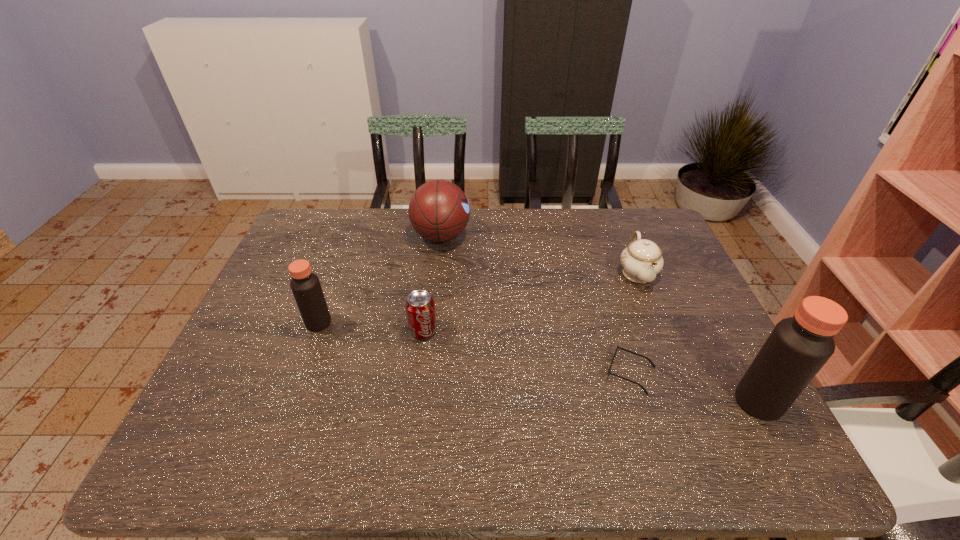
Locate an element on the screen. This screenshot has width=960, height=540. object that is the third nearest to the basketball is located at coordinates (641, 261).

Image resolution: width=960 pixels, height=540 pixels. I want to click on vacant space that satisfies the following two spatial constraints: 1. on the back side of the left vinegar; 2. on the left side of the basketball, so click(350, 236).

Locate an element on the screen. vacant space that satisfies the following two spatial constraints: 1. at the spout of the chinaware; 2. on the lenses of the sunglasses is located at coordinates (678, 373).